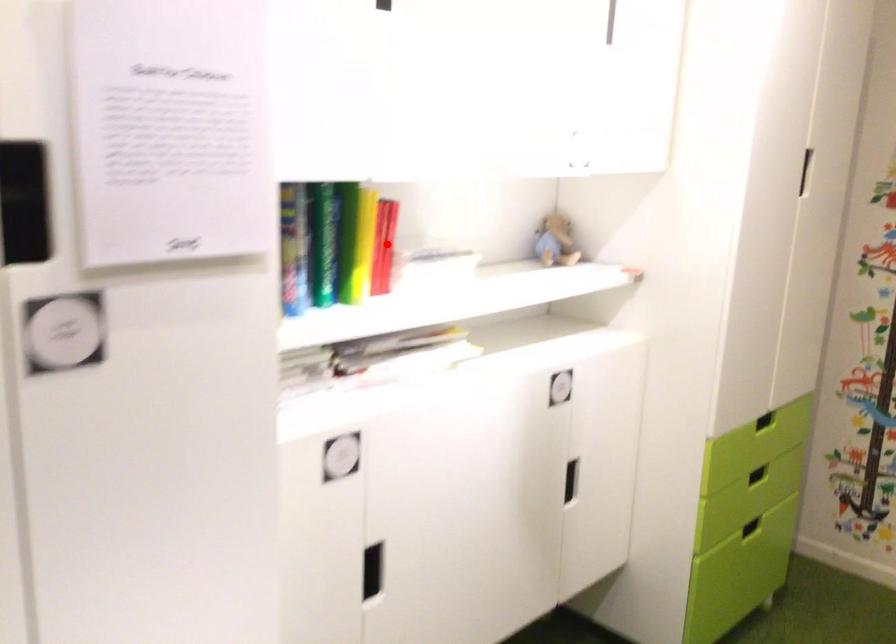
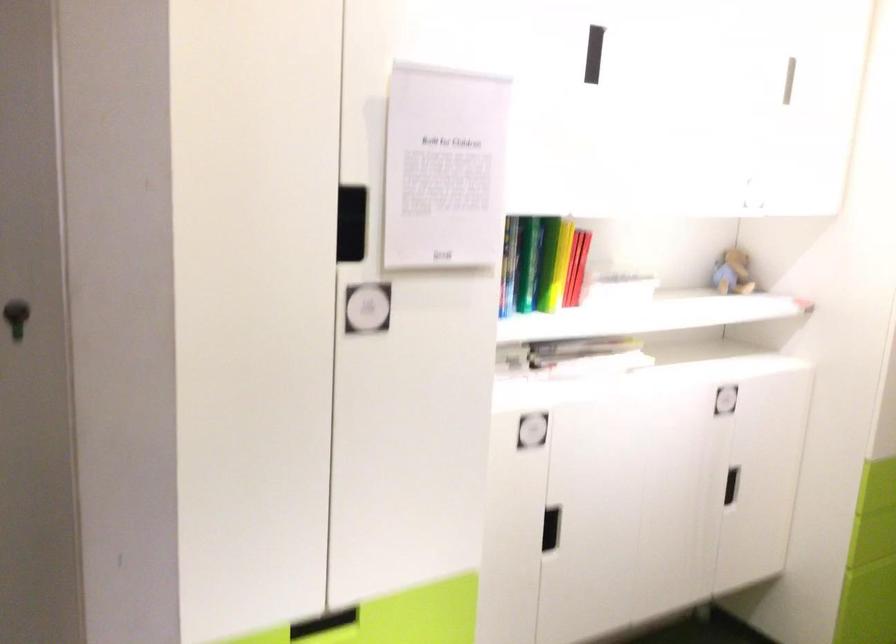
The point at the highlighted location is marked in the first image. Where is the corresponding point in the second image?

(576, 267)